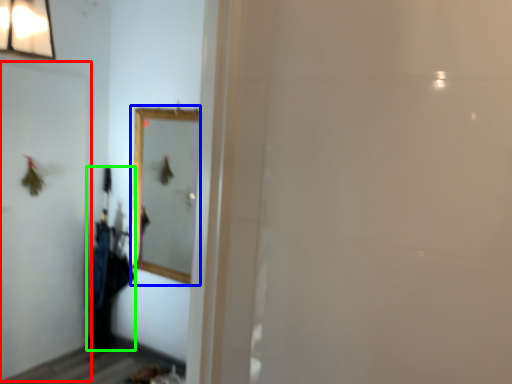
Question: Based on their relative distances, which object is nearer to screen door (highlighted by a red box)? Choose from mirror (highlighted by a blue box) and laundry (highlighted by a green box).

Choices:
 (A) mirror
 (B) laundry

Answer: (B)